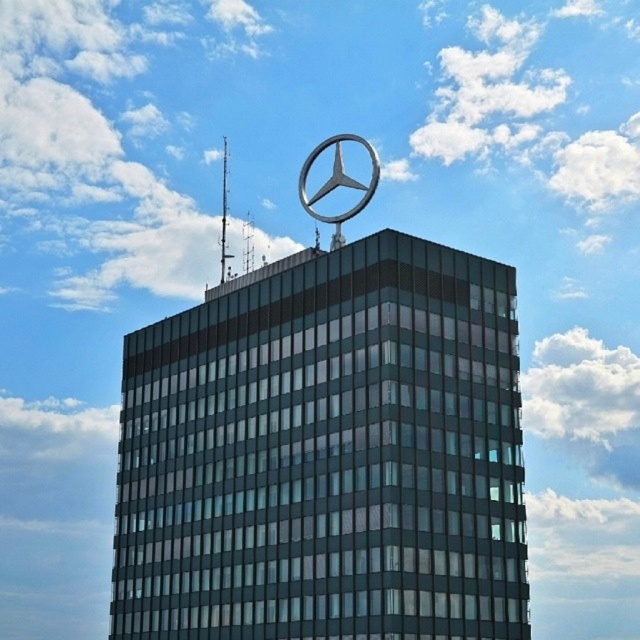
You are a drone operator tasked with capturing aerial footage of the building. The Mercedes emblem is located at point (326, 452). If you want to position your drone directly above the emblem, which direction should you fly from the current position at point 0.6, 0.5?

The point (326, 452) is to the right of the current position at 0.6, 0.5. Therefore, you should fly the drone to the right to position it directly above the metallic silver mercedes benz emblem at upper center.